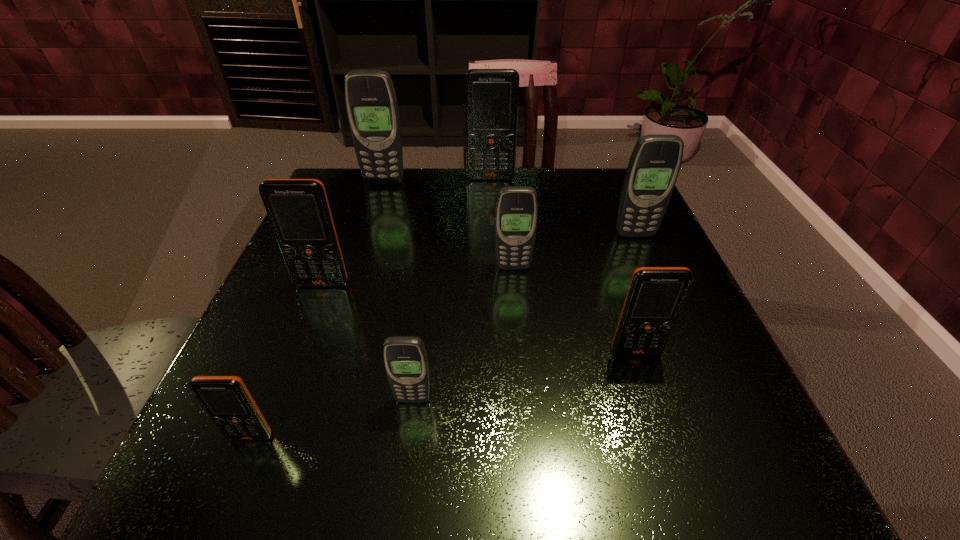
Where is `vacant space at the near left corner of the desktop`? Image resolution: width=960 pixels, height=540 pixels. vacant space at the near left corner of the desktop is located at coordinates (224, 443).

I want to click on blank space at the far right corner, so click(573, 170).

Identify the location of empty location between the second biggest orange cellular telephone and the second gray cellular telephone from left to right. (368, 342).

You are a GUI agent. You are given a task and a screenshot of the screen. Output one action in this format:
    pyautogui.click(x=<x>, y=<y>)
    Task: Click on the free area in between the farthest orange cellular telephone and the third nearest gray cellular telephone
    The image size is (960, 540).
    Given the screenshot: What is the action you would take?
    pyautogui.click(x=563, y=206)

Identify the location of vacant space that's between the fourth nearest object and the farthest gray cellular telephone. The width and height of the screenshot is (960, 540). (353, 233).

The height and width of the screenshot is (540, 960). I want to click on unoccupied position between the fifth farthest cellular telephone and the third biggest orange cellular telephone, so click(479, 318).

Find the location of a particular element. This screenshot has width=960, height=540. free space between the nearest orange cellular telephone and the farthest gray cellular telephone is located at coordinates (318, 309).

Where is `free space between the nearest gray cellular telephone and the rightmost orange cellular telephone`? This screenshot has width=960, height=540. free space between the nearest gray cellular telephone and the rightmost orange cellular telephone is located at coordinates (524, 376).

Locate an element on the screen. free spot between the second farthest orange cellular telephone and the nearest orange cellular telephone is located at coordinates (287, 361).

The width and height of the screenshot is (960, 540). In order to click on free space between the second nearest cellular telephone and the farthest gray cellular telephone in this screenshot , I will do `click(398, 291)`.